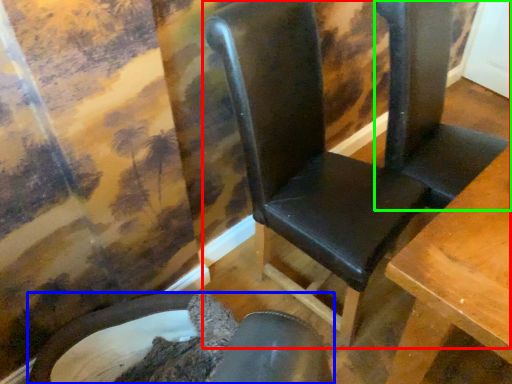
Question: Considering the real-world distances, which object is farthest from chair (highlighted by a red box)? chair (highlighted by a blue box) or folding chair (highlighted by a green box)?

Choices:
 (A) chair
 (B) folding chair

Answer: (A)